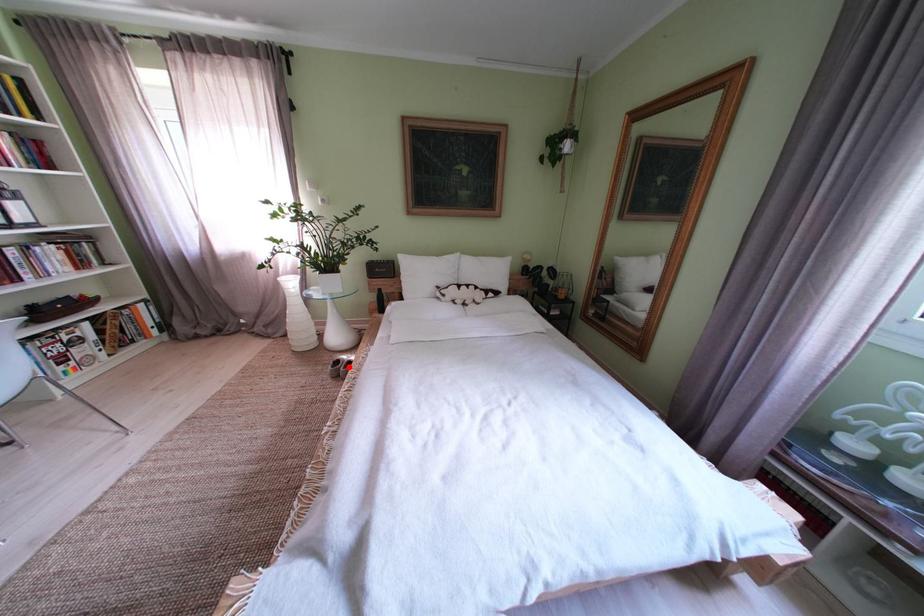
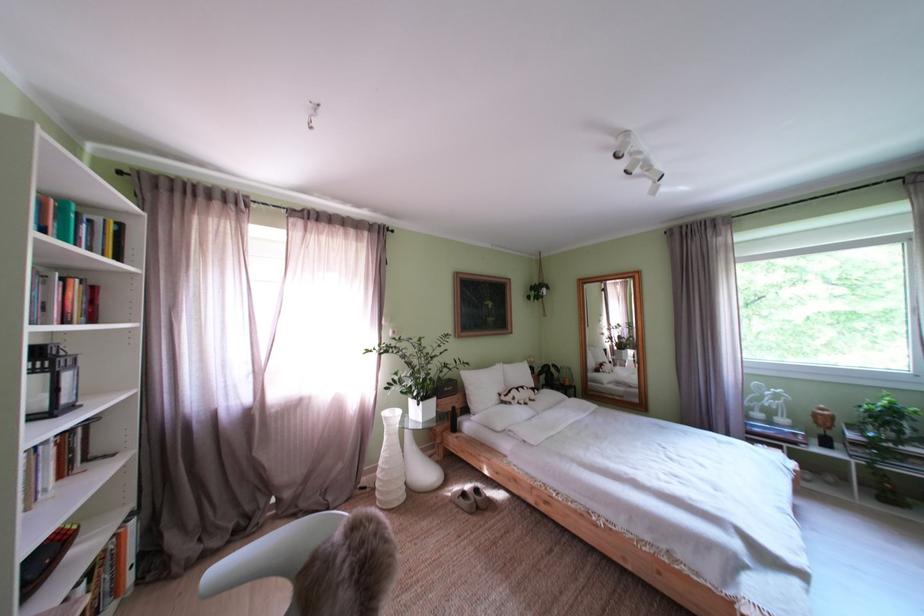
Question: I am providing you with two images of the same scene from different viewpoints. Image1 has a red point marked. In image2, the corresponding 3D location appears at what relative position? Reply with the corresponding letter.

Choices:
 (A) Closer
 (B) Farther

Answer: (A)